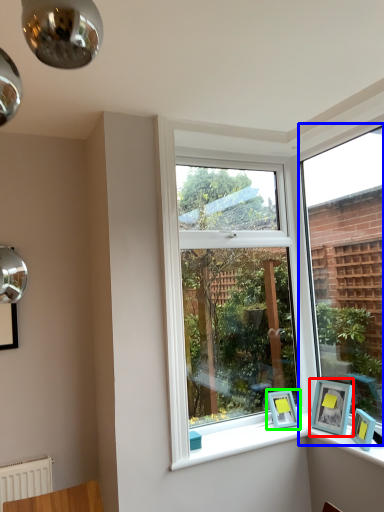
Question: Which is nearer to the picture frame (highlighted by a red box)? window (highlighted by a blue box) or picture frame (highlighted by a green box).

Choices:
 (A) window
 (B) picture frame

Answer: (B)